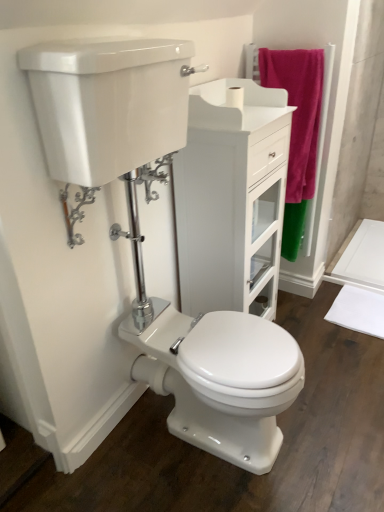
Find the location of a particular element. Image resolution: width=384 pixels, height=512 pixels. free space above pink fuzzy towel at upper right (from a real-world perspective) is located at coordinates (291, 42).